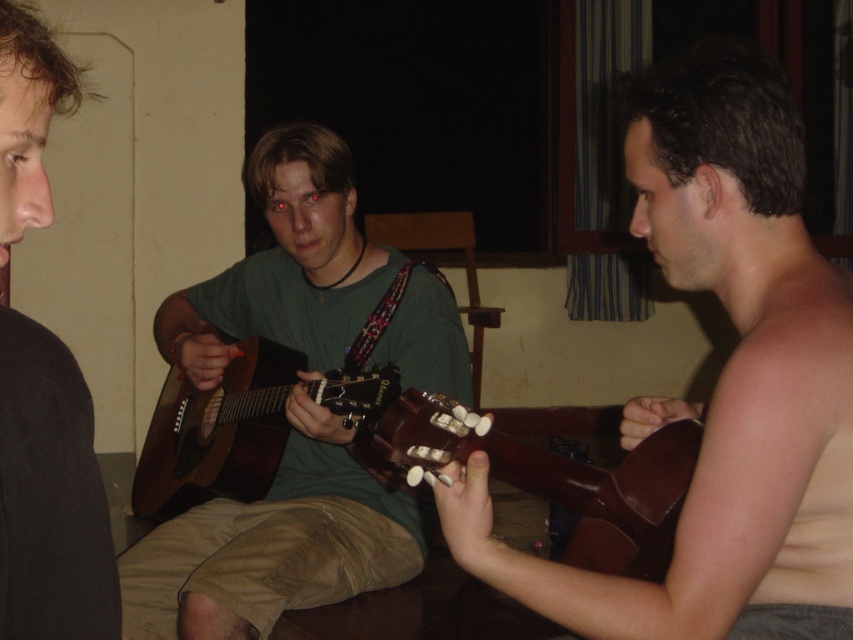
You are a photographer trying to capture a photo of the green matte guitar at center and the brown acoustic guitar at center. If you want to frame both guitars in your shot, which guitar should you position closer to the left side of the frame?

The green matte guitar at center should be positioned closer to the left side of the frame since it is already to the left of the brown acoustic guitar at center.

You are a photographer setting up for a group photo. The two guitars, brown wood guitar at right and brown acoustic guitar at center, need to be placed within a 1.5 meter distance to fit in the frame. Can they be positioned close enough based on their current spacing?

The brown wood guitar at right is 1.05 meters away from the brown acoustic guitar at center, which is within the 1.5 meter requirement. Therefore, they can be positioned close enough to fit in the frame.